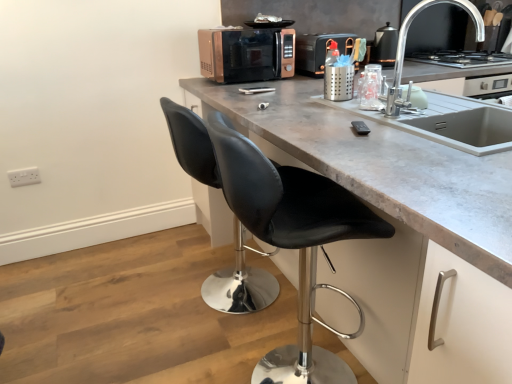
Question: Does point (291, 49) appear closer or farther from the camera than point (364, 195)?

Choices:
 (A) closer
 (B) farther

Answer: (B)

Question: Considering the positions of rose gold metallic microwave at center and concrete gray countertop at center in the image, is rose gold metallic microwave at center wider or thinner than concrete gray countertop at center?

Choices:
 (A) thin
 (B) wide

Answer: (A)

Question: Estimate the real-world distances between objects in this image. Which object is farther from the metallic silver kettle at upper right, the second appliance from the left?

Choices:
 (A) rose gold metallic toaster at upper center, the second appliance in the right-to-left sequence
 (B) silver metallic faucet at upper right
 (C) rose gold metallic microwave at center
 (D) black leather stool at center
 (E) concrete gray countertop at center

Answer: (D)

Question: Considering the real-world distances, which object is closest to the rose gold metallic microwave at center?

Choices:
 (A) white plastic electrical outlet at lower left
 (B) concrete gray countertop at center
 (C) rose gold metallic toaster at upper center, the second appliance in the right-to-left sequence
 (D) black leather stool at center
 (E) stainless steel gas stove at upper right

Answer: (C)